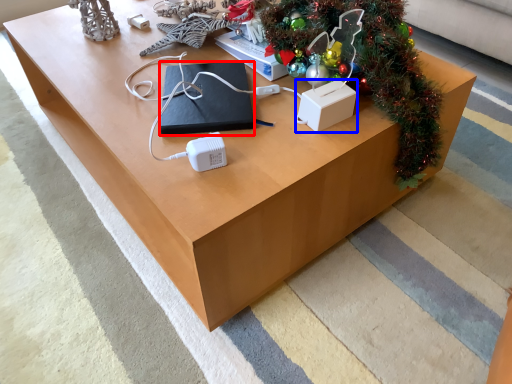
Question: Among these objects, which one is farthest to the camera, pad (highlighted by a red box) or box (highlighted by a blue box)?

Choices:
 (A) pad
 (B) box

Answer: (A)